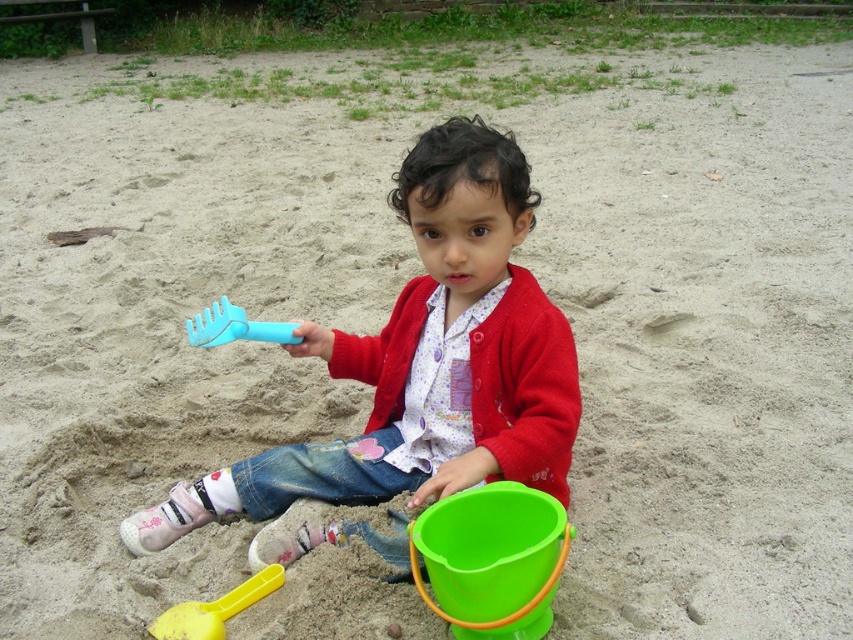
You are a child playing in the sandbox and you see two points marked in the sand. One is at point (479, 582) and the other is at point (254, 321). Which point is closer to you?

Point (479, 582) is in front of point (254, 321), so it is closer to you.

You are helping a child in a sandbox. The child has a green plastic bucket at lower center and a blue plastic rake at center. Which object is larger?

The green plastic bucket at lower center is bigger than the blue plastic rake at center.

You are helping a child in a sandbox. The child wants to know which object is wider between the green plastic bucket at lower center and the blue plastic rake at center. Can you tell them?

The green plastic bucket at lower center is wider than the blue plastic rake at center because its width surpasses the rake.